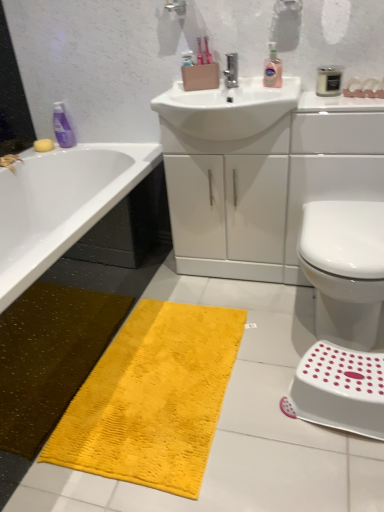
Where is `free space in front of pink glossy liquid soap at upper center`? The image size is (384, 512). free space in front of pink glossy liquid soap at upper center is located at coordinates (280, 87).